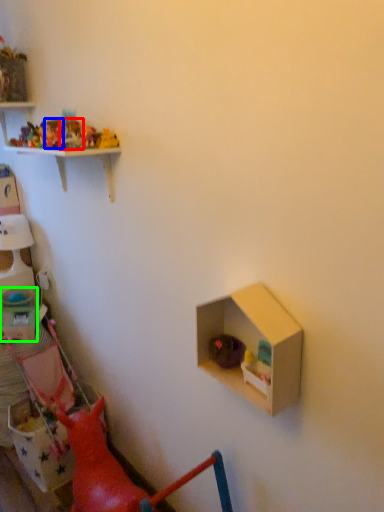
Question: Based on their relative distances, which object is nearer to toy (highlighted by a red box)? Choose from toy (highlighted by a blue box) and box (highlighted by a green box).

Choices:
 (A) toy
 (B) box

Answer: (A)